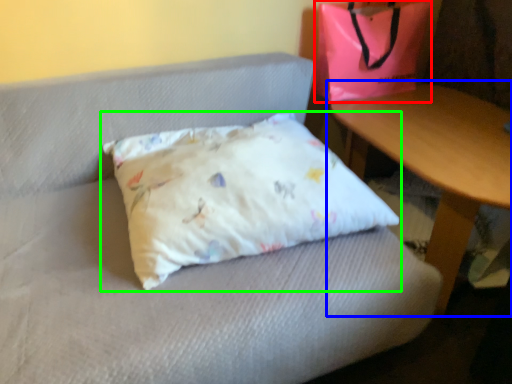
Question: Which object is the farthest from pouch (highlighted by a red box)? Choose among these: table (highlighted by a blue box) or pillow (highlighted by a green box).

Choices:
 (A) table
 (B) pillow

Answer: (B)